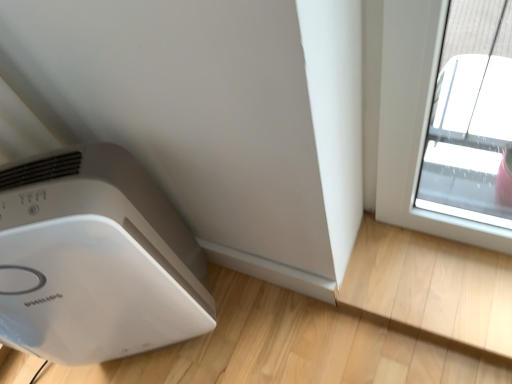
Describe the element at coordinates (95, 260) in the screenshot. I see `white plastic air purifier at lower left` at that location.

Locate an element on the screen. white plastic air purifier at lower left is located at coordinates (95, 260).

At what (x,y) coordinates should I click in order to perform the action: click on white plastic air purifier at lower left. Please return your answer as a coordinate pair (x, y). This screenshot has height=384, width=512. Looking at the image, I should click on pyautogui.click(x=95, y=260).